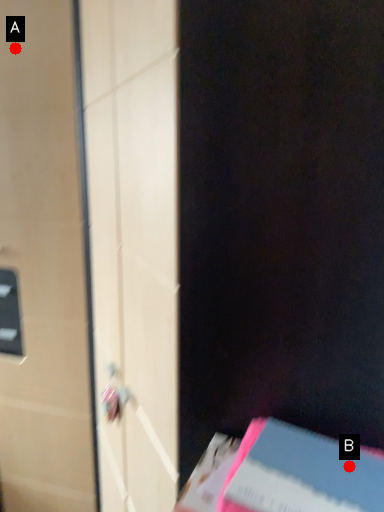
Question: Two points are circled on the image, labeled by A and B beside each circle. Which of the following is the farthest from the observer?

Choices:
 (A) A is further
 (B) B is further

Answer: (A)